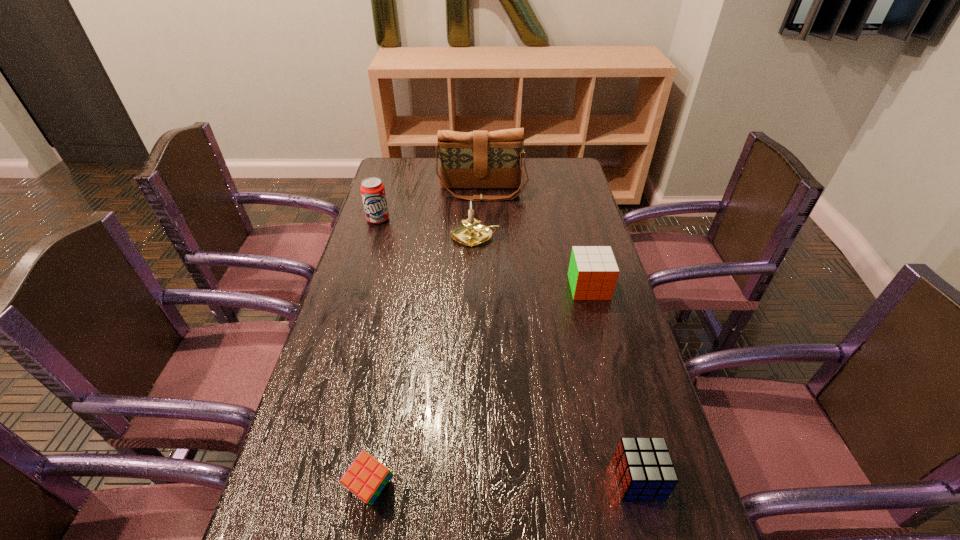
This screenshot has height=540, width=960. Identify the location of vacant space that's between the leftmost cube and the second farthest object. (374, 354).

This screenshot has width=960, height=540. I want to click on free space between the third shortest object and the fifth nearest object, so click(484, 253).

I want to click on vacant point located between the fifth object from right to left and the soda can, so click(x=374, y=354).

You are a GUI agent. You are given a task and a screenshot of the screen. Output one action in this format:
    pyautogui.click(x=<x>, y=<y>)
    Task: Click on the vacant area that lies between the leftmost cube and the fourth nearest object
    
    Given the screenshot: What is the action you would take?
    click(x=423, y=362)

I want to click on free space between the second object from left to right and the candle holder, so click(423, 362).

At what (x,y) coordinates should I click in order to perform the action: click on unoccupied position between the candle holder and the tallest cube. Please return your answer as a coordinate pair (x, y). The width and height of the screenshot is (960, 540). Looking at the image, I should click on (532, 262).

In order to click on vacant area between the farthest cube and the second farthest object in this screenshot , I will do `click(484, 253)`.

Identify the location of object that ranks as the fourth closest to the leftmost cube. (x=372, y=189).

Where is `object that is the second closest to the candle holder`? The width and height of the screenshot is (960, 540). object that is the second closest to the candle holder is located at coordinates (372, 189).

You are a GUI agent. You are given a task and a screenshot of the screen. Output one action in this format:
    pyautogui.click(x=<x>, y=<y>)
    Task: Click on the cube that stands as the second closest to the tallest cube
    Image resolution: width=960 pixels, height=540 pixels.
    Given the screenshot: What is the action you would take?
    pyautogui.click(x=366, y=477)